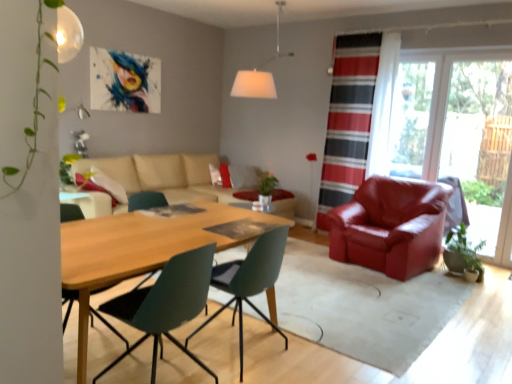
This screenshot has width=512, height=384. Find the location of `green leafy plant at left`. green leafy plant at left is located at coordinates (40, 74).

You are a GUI agent. You are given a task and a screenshot of the screen. Output one action in this format:
    pyautogui.click(x=<x>, y=<y>)
    Task: Click on the beige fabric couch at center
    
    Given the screenshot: What is the action you would take?
    pyautogui.click(x=162, y=175)

The image size is (512, 384). What do you see at coordinates (410, 118) in the screenshot? I see `transparent plastic window screen at upper right` at bounding box center [410, 118].

Based on the photo, how much space does teal plastic chair at center, marked as the 1th chair in a left-to-right arrangement, occupy vertically?

The height of teal plastic chair at center, marked as the 1th chair in a left-to-right arrangement, is 33.13 inches.

This screenshot has width=512, height=384. What are the coordinates of `green leafy plant at left` in the screenshot? It's located at (40, 74).

Considering the sizes of objects beige fabric couch at center and green matte houseplant at lower right in the image provided, who is smaller, beige fabric couch at center or green matte houseplant at lower right?

green matte houseplant at lower right is smaller.

How distant is beige fabric couch at center from green matte houseplant at lower right?

A distance of 3.22 meters exists between beige fabric couch at center and green matte houseplant at lower right.

From a real-world perspective, is beige fabric couch at center physically above green matte houseplant at lower right?

Indeed, from a real-world perspective, beige fabric couch at center stands above green matte houseplant at lower right.

From the image's perspective, between beige fabric couch at center and green matte houseplant at lower right, which one is located above?

beige fabric couch at center is shown above in the image.

From the image's perspective, who appears lower, beige fabric couch at center or wooden table at center?

wooden table at center is shown below in the image.

Is beige fabric couch at center facing towards wooden table at center?

Yes, beige fabric couch at center is oriented towards wooden table at center.

Are beige fabric couch at center and wooden table at center far apart?

beige fabric couch at center is positioned a significant distance from wooden table at center.

Is beige fabric couch at center wider or thinner than wooden table at center?

beige fabric couch at center is wider than wooden table at center.

Image resolution: width=512 pixels, height=384 pixels. Find the location of `plant lying above the transparent glass door at right (from the image's perspective)`. plant lying above the transparent glass door at right (from the image's perspective) is located at coordinates (40, 74).

Considering the positions of points (28, 165) and (435, 118), is point (28, 165) closer to camera compared to point (435, 118)?

That is True.

How different are the orientations of green leafy plant at left and transparent glass door at right in degrees?

180 degrees.

Does green leafy plant at left have a greater height compared to transparent glass door at right?

No, green leafy plant at left is not taller than transparent glass door at right.

Between point (432, 119) and point (79, 36), which one is positioned behind?

The point (432, 119) is more distant.

Looking at their sizes, would you say transparent glass door at right is wider or thinner than green leafy plant at left?

In the image, transparent glass door at right appears to be more narrow than green leafy plant at left.

Between transparent glass door at right and green leafy plant at left, which one is positioned behind?

Positioned behind is transparent glass door at right.

Is transparent glass door at right to the right of green leafy plant at left from the viewer's perspective?

Yes, transparent glass door at right is to the right of green leafy plant at left.

From a real-world perspective, is teal plastic chair at center, the third chair when ordered from back to front, physically above white fabric lampshade at upper center?

No, from a real-world perspective, teal plastic chair at center, the third chair when ordered from back to front, is not over white fabric lampshade at upper center

Is teal plastic chair at center, which is counted as the 1th chair, starting from the front, turned away from white fabric lampshade at upper center?

No, teal plastic chair at center, which is counted as the 1th chair, starting from the front, is not facing away from white fabric lampshade at upper center.

Is teal plastic chair at center, the third chair when ordered from back to front, directly adjacent to white fabric lampshade at upper center?

No.

Is wooden table at center turned away from white fabric lampshade at upper center?

No, white fabric lampshade at upper center is not at the back of wooden table at center.

Consider the image. Does wooden table at center have a smaller size compared to white fabric lampshade at upper center?

No, wooden table at center is not smaller than white fabric lampshade at upper center.

Find the location of a particular element. The width and height of the screenshot is (512, 384). kitchen & dining room table that appears on the left of white fabric lampshade at upper center is located at coordinates (146, 247).

Relative to white fabric lampshade at upper center, is wooden table at center in front or behind?

In the image, wooden table at center appears in front of white fabric lampshade at upper center.

Are wooden table at center and green leafy plant at left far apart?

Yes, wooden table at center and green leafy plant at left are located far from each other.

Which is behind, point (126, 258) or point (13, 170)?

The point (126, 258) is more distant.

Looking at this image, from the image's perspective, between wooden table at center and green leafy plant at left, which one is located above?

green leafy plant at left.

The width and height of the screenshot is (512, 384). In order to click on kitchen & dining room table below the green leafy plant at left (from the image's perspective) in this screenshot , I will do `click(146, 247)`.

Where is `studio couch behind the green matte houseplant at lower right`? studio couch behind the green matte houseplant at lower right is located at coordinates (162, 175).

There is a wooden table at center. At what (x,y) coordinates should I click in order to perform the action: click on studio couch above it (from a real-world perspective). Please return your answer as a coordinate pair (x, y). The height and width of the screenshot is (384, 512). Looking at the image, I should click on (162, 175).

When comparing their distances from striped fabric curtain at right, does transparent glass door at right or wooden table at center seem further?

wooden table at center.

Looking at the image, which one is located closer to matte green chair at center, marked as the 2th chair in a left-to-right arrangement, wooden table at center or white fabric lampshade at upper center?

wooden table at center.

When comparing their distances from beige fabric couch at center, does white fabric lampshade at upper center or satin red armchair at right, placed as the first chair when sorted from right to left, seem closer?

white fabric lampshade at upper center lies closer to beige fabric couch at center than the other object.

From the image, which object appears to be nearer to transparent glass door at right, beige fabric couch at center or white fabric lampshade at upper center?

white fabric lampshade at upper center.

From the image, which object appears to be nearer to beige fabric couch at center, striped fabric curtain at right or transparent plastic window screen at upper right?

striped fabric curtain at right.

From the image, which object appears to be farther from green leafy plant at left, white fabric lampshade at upper center or wooden table at center?

white fabric lampshade at upper center is positioned further to the anchor green leafy plant at left.

Considering their positions, is white fabric lampshade at upper center positioned closer to transparent plastic window screen at upper right than matte green chair at center, the 2th chair when ordered from right to left?

white fabric lampshade at upper center.

Considering their positions, is green matte houseplant at lower right positioned further to wooden table at center than white fabric lampshade at upper center?

Among the two, green matte houseplant at lower right is located further to wooden table at center.

Where is `light fixture located between teal plastic chair at center, the third chair when ordered from back to front, and striped fabric curtain at right in the depth direction`? This screenshot has height=384, width=512. light fixture located between teal plastic chair at center, the third chair when ordered from back to front, and striped fabric curtain at right in the depth direction is located at coordinates (260, 72).

You are a GUI agent. You are given a task and a screenshot of the screen. Output one action in this format:
    pyautogui.click(x=<x>, y=<y>)
    Task: Click on the window screen between beige fabric couch at center and green matte houseplant at lower right
    
    Given the screenshot: What is the action you would take?
    pyautogui.click(x=410, y=118)

This screenshot has width=512, height=384. Identify the location of kitchen & dining room table positioned between green leafy plant at left and satin red armchair at right, placed as the first chair when sorted from right to left, from near to far. (146, 247).

At what (x,y) coordinates should I click in order to perform the action: click on curtain located between teal plastic chair at center, marked as the 1th chair in a left-to-right arrangement, and transparent plastic window screen at upper right in the depth direction. Please return your answer as a coordinate pair (x, y). This screenshot has width=512, height=384. Looking at the image, I should click on (349, 118).